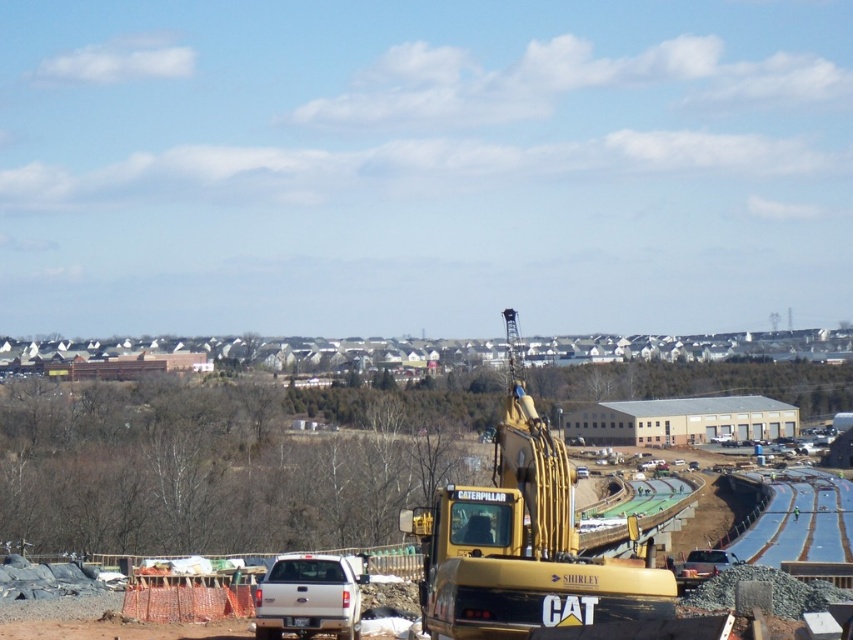
Question: Which point appears closest to the camera in this image?

Choices:
 (A) (508, 428)
 (B) (699, 570)

Answer: (A)

Question: Is white matte truck at center below metallic silver car at center?

Choices:
 (A) no
 (B) yes

Answer: (A)

Question: Is yellow metallic excavator at center thinner than metallic silver car at center?

Choices:
 (A) yes
 (B) no

Answer: (B)

Question: Which is nearer to the yellow metallic excavator at center?

Choices:
 (A) metallic silver car at center
 (B) white matte truck at center

Answer: (B)

Question: Does yellow metallic excavator at center appear under metallic silver car at center?

Choices:
 (A) yes
 (B) no

Answer: (B)

Question: Which of the following is the farthest from the observer?

Choices:
 (A) metallic silver car at center
 (B) white matte truck at center

Answer: (A)